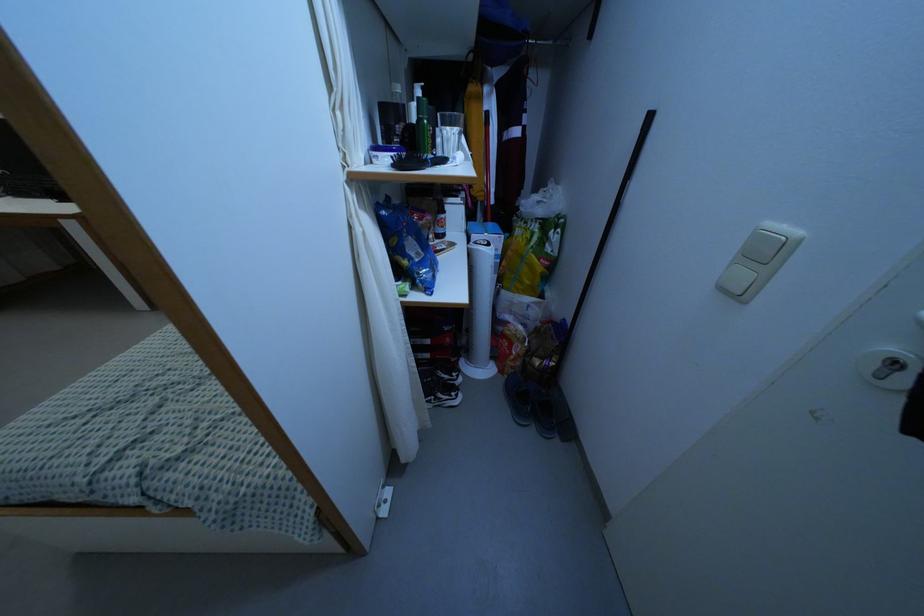
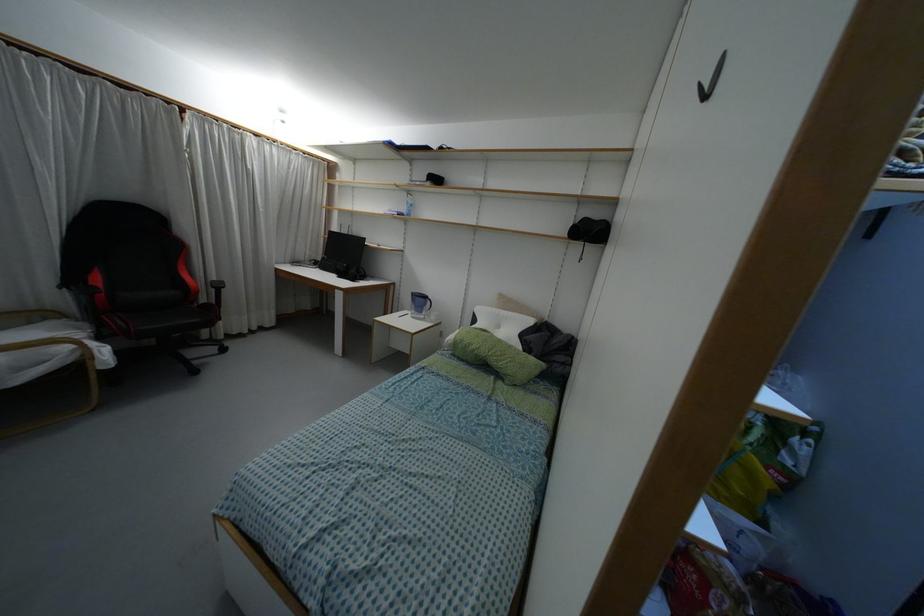
Locate, in the second image, the point that corresponds to (64,197) in the first image.

(341, 275)